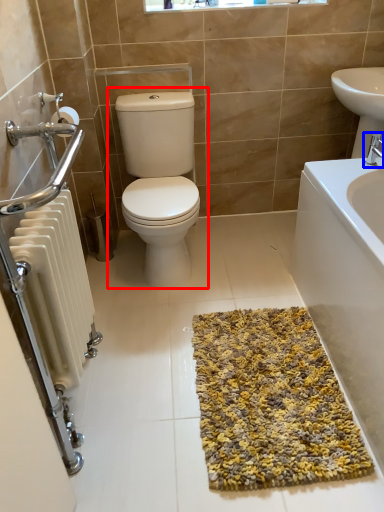
Question: Among these objects, which one is nearest to the camera, toilet (highlighted by a red box) or tap (highlighted by a blue box)?

Choices:
 (A) toilet
 (B) tap

Answer: (A)